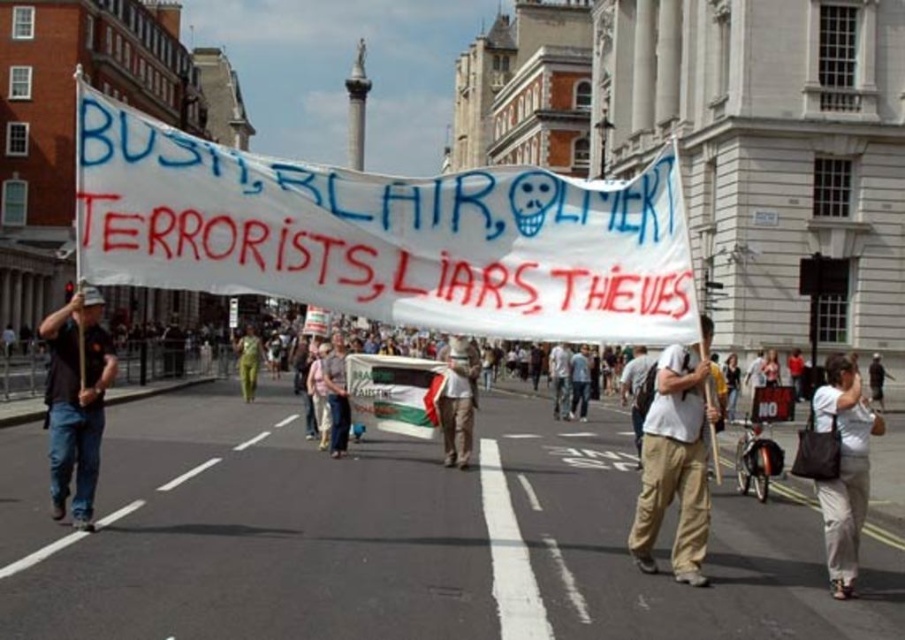
Question: Can you confirm if denim pants at center is positioned to the left of green fabric pants at center?

Choices:
 (A) no
 (B) yes

Answer: (A)

Question: Is white fabric banner at center to the right of green fabric pants at center from the viewer's perspective?

Choices:
 (A) yes
 (B) no

Answer: (A)

Question: Which point is closer to the camera?

Choices:
 (A) green fabric pants at center
 (B) white cotton t-shirt at center
 (C) white cotton shirt at center

Answer: (B)

Question: Is white cotton t-shirt at center in front of white cotton shirt at center?

Choices:
 (A) no
 (B) yes

Answer: (B)

Question: Which point is closer to the camera?

Choices:
 (A) denim pants at center
 (B) white fabric banner at center
 (C) white cotton t-shirt at center

Answer: (C)

Question: Which object is positioned farthest from the white cotton shirt at lower right?

Choices:
 (A) white fabric banner at center
 (B) white cotton t-shirt at center

Answer: (A)